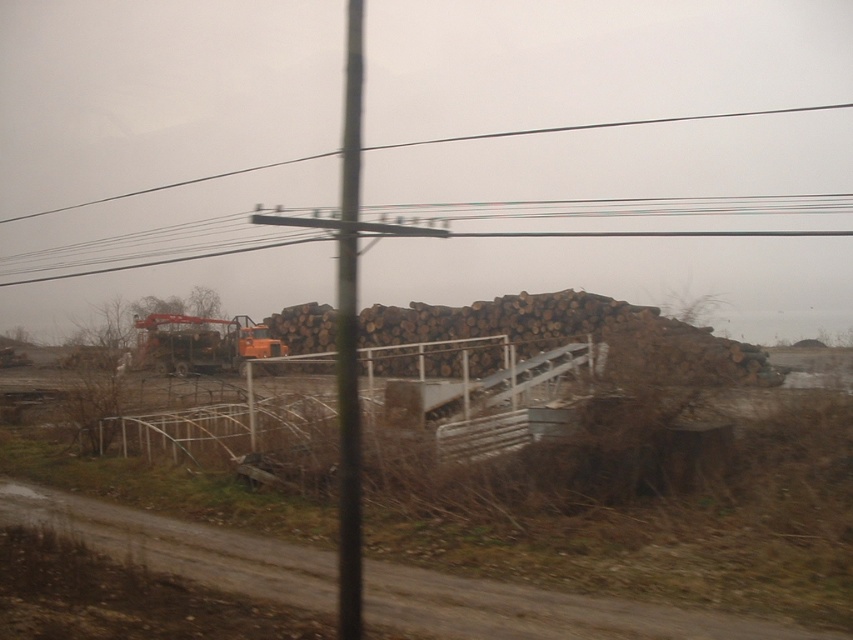
Question: Which of the following is the closest to the observer?

Choices:
 (A) (354, 4)
 (B) (212, 358)

Answer: (B)

Question: Considering the real-world distances, which object is farthest from the metallic pole at center?

Choices:
 (A) orange metallic excavator at center
 (B) metallic wire at upper center

Answer: (B)

Question: Can you confirm if metallic pole at center is positioned below orange metallic excavator at center?

Choices:
 (A) no
 (B) yes

Answer: (A)

Question: Observing the image, what is the correct spatial positioning of metallic pole at center in reference to metallic wire at upper center?

Choices:
 (A) below
 (B) above

Answer: (A)

Question: Can you confirm if metallic pole at center is positioned above metallic wire at upper center?

Choices:
 (A) yes
 (B) no

Answer: (B)

Question: Which point is closer to the camera?

Choices:
 (A) (659, 198)
 (B) (345, 332)
 (C) (136, 340)

Answer: (B)